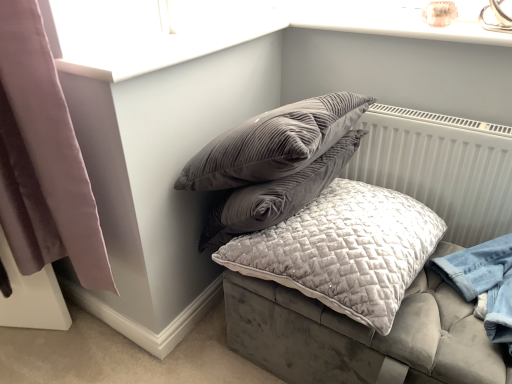
Question: Is mauve velvet curtain at left looking in the opposite direction of velvet grey cushion at center?

Choices:
 (A) no
 (B) yes

Answer: (A)

Question: Does mauve velvet curtain at left turn towards velvet grey cushion at center?

Choices:
 (A) no
 (B) yes

Answer: (A)

Question: Is mauve velvet curtain at left thinner than velvet grey cushion at center?

Choices:
 (A) yes
 (B) no

Answer: (A)

Question: Is mauve velvet curtain at left in front of velvet grey cushion at center?

Choices:
 (A) yes
 (B) no

Answer: (A)

Question: From the image's perspective, is mauve velvet curtain at left located above velvet grey cushion at center?

Choices:
 (A) yes
 (B) no

Answer: (A)

Question: From a real-world perspective, is velvet grey cushion at center above or below velvet quilted pillow at center?

Choices:
 (A) above
 (B) below

Answer: (B)

Question: In terms of size, does velvet grey cushion at center appear bigger or smaller than velvet quilted pillow at center?

Choices:
 (A) big
 (B) small

Answer: (A)

Question: In terms of height, does velvet grey cushion at center look taller or shorter compared to velvet quilted pillow at center?

Choices:
 (A) tall
 (B) short

Answer: (A)

Question: Looking at their shapes, would you say velvet grey cushion at center is wider or thinner than velvet quilted pillow at center?

Choices:
 (A) thin
 (B) wide

Answer: (B)

Question: From the image's perspective, relative to white textured radiator at upper right, is velvet grey cushion at center above or below?

Choices:
 (A) below
 (B) above

Answer: (A)

Question: From a real-world perspective, is velvet grey cushion at center physically located above or below white textured radiator at upper right?

Choices:
 (A) above
 (B) below

Answer: (B)

Question: Is point (489, 165) positioned closer to the camera than point (507, 208)?

Choices:
 (A) farther
 (B) closer

Answer: (B)

Question: Considering the positions of velvet grey cushion at center and white textured radiator at upper right in the image, is velvet grey cushion at center bigger or smaller than white textured radiator at upper right?

Choices:
 (A) small
 (B) big

Answer: (B)

Question: In terms of width, does velvet quilted pillow at center look wider or thinner when compared to velvet grey cushion at center?

Choices:
 (A) thin
 (B) wide

Answer: (A)

Question: Considering the relative positions of velvet quilted pillow at center and velvet grey cushion at center in the image provided, is velvet quilted pillow at center to the left or to the right of velvet grey cushion at center?

Choices:
 (A) left
 (B) right

Answer: (A)